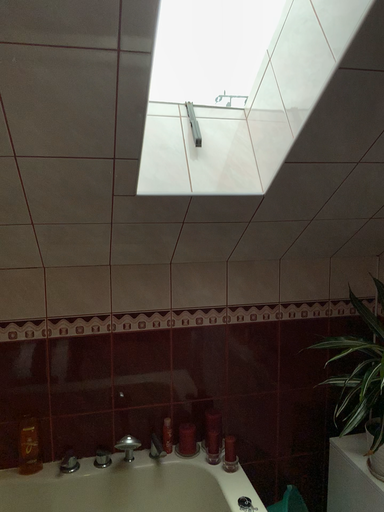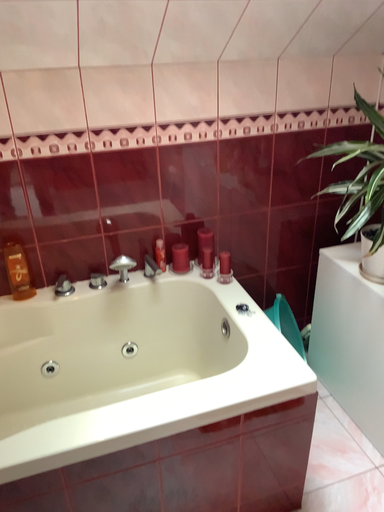
Question: Which way did the camera rotate in the video?

Choices:
 (A) rotated upward
 (B) rotated downward

Answer: (B)